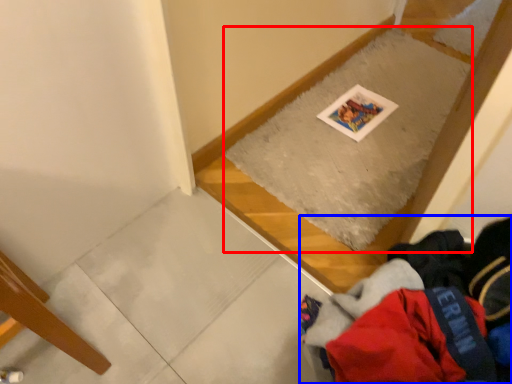
Question: Which point is further to the camera, mat (highlighted by a red box) or clothing (highlighted by a blue box)?

Choices:
 (A) mat
 (B) clothing

Answer: (A)